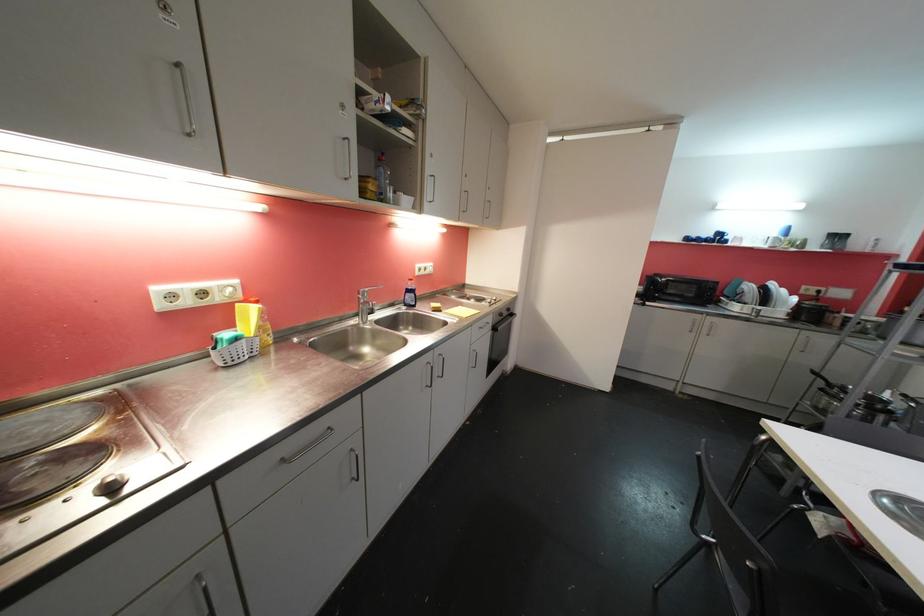
Locate an element on the screen. The width and height of the screenshot is (924, 616). oven door handle is located at coordinates (503, 323).